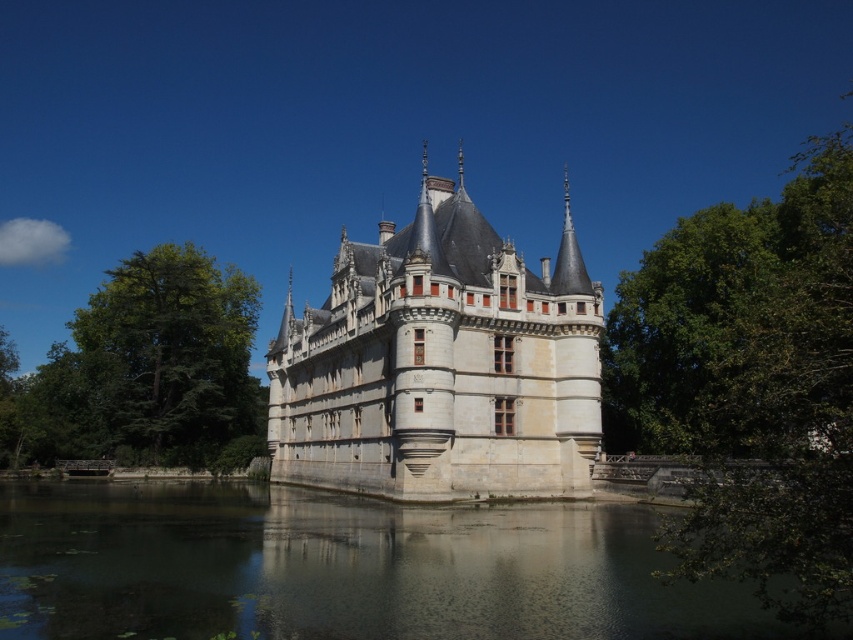
You are a knight standing at the base of the castle. You need to cross from the green leafy tree at right to the green leafy tree at left. If your horse can jump a maximum distance of 80 meters, will you be able to make the jump in one go?

The distance between the green leafy tree at right and the green leafy tree at left is 75.30 meters. Since your horse can jump up to 80 meters, you can make the jump in one go.

You are standing at the base of the castle and notice a point marked at coordinates [341,568]. Based on the scene described, what does this point likely represent?

The point at [341,568] corresponds to transparent water at lower center, as indicated by the Objects Description.